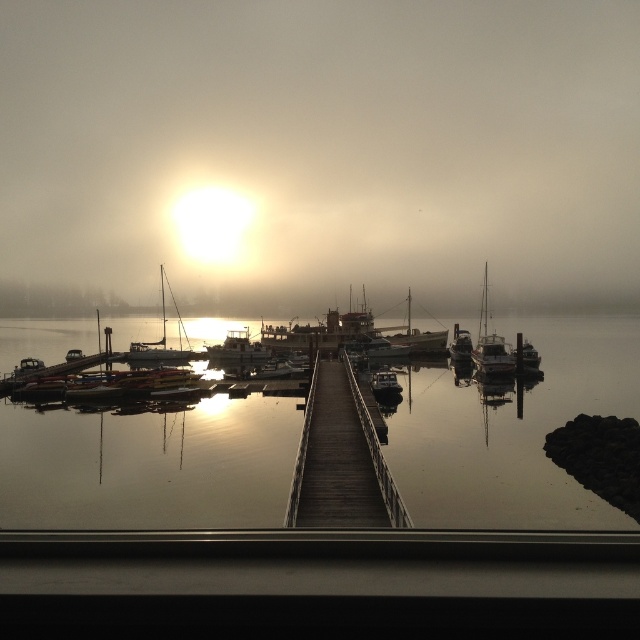
You are standing on the wooden pier and want to see the shiny silver sailboat at left clearly. Is the foggy mist at center blocking your view of the sailboat?

The foggy mist at center is above the shiny silver sailboat at left, so it might partially block the view but since it is above, the sailboat can still be seen below the mist.

You are planning to dock your boat at the wooden dock at center. Considering the size of the metallic silver boat at right already there, will your boat fit alongside it?

The wooden dock at center has a smaller size compared to metallic silver boat at right. Since the dock is smaller than the existing boat, there might not be enough space for your boat to fit alongside the metallic silver boat at right.